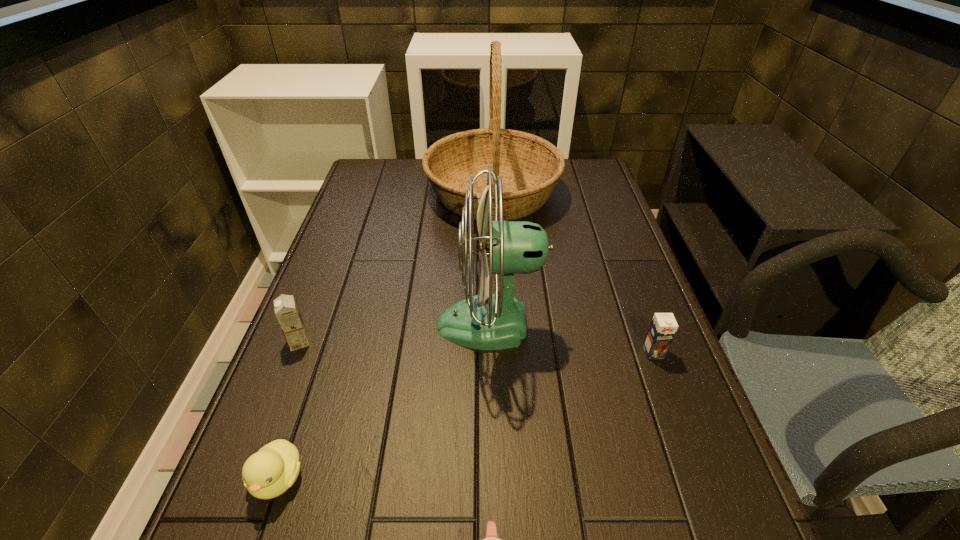
You are a GUI agent. You are given a task and a screenshot of the screen. Output one action in this format:
    pyautogui.click(x=<x>, y=<y>)
    Task: Click on the vacant area situated on the right of the left chocolate milk
    
    Given the screenshot: What is the action you would take?
    pyautogui.click(x=356, y=342)

This screenshot has width=960, height=540. I want to click on vacant point located 0.190m on the front label of the shorter chocolate milk, so click(686, 444).

You are a GUI agent. You are given a task and a screenshot of the screen. Output one action in this format:
    pyautogui.click(x=<x>, y=<y>)
    Task: Click on the object located at the far edge
    
    Given the screenshot: What is the action you would take?
    pyautogui.click(x=530, y=166)

You are a GUI agent. You are given a task and a screenshot of the screen. Output one action in this format:
    pyautogui.click(x=<x>, y=<y>)
    Task: Click on the chocolate milk positioned at the left edge
    This screenshot has height=540, width=960.
    Given the screenshot: What is the action you would take?
    tap(286, 310)

Find the location of a particular element. duckling situated at the left edge is located at coordinates (268, 473).

Locate an element on the screen. The width and height of the screenshot is (960, 540). basket at the right edge is located at coordinates (530, 166).

Identify the location of chocolate milk that is positioned at the right edge. The width and height of the screenshot is (960, 540). (663, 327).

Find the location of a particular element. object situated at the far right corner is located at coordinates (530, 166).

Where is `vacant point at the left edge`? vacant point at the left edge is located at coordinates (234, 510).

I want to click on vacant region at the right edge of the desktop, so click(x=599, y=222).